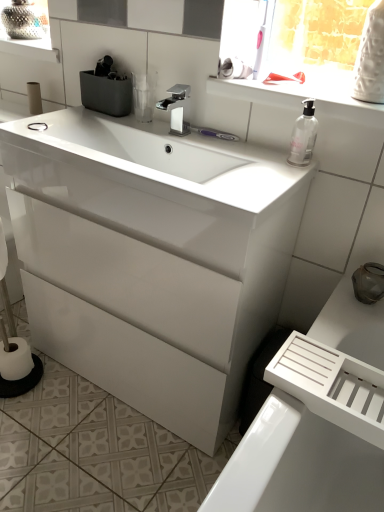
Question: Does white glossy cabinet at center have a lesser height compared to white matte toilet paper at left, which appears as the first toilet paper when viewed from the top?

Choices:
 (A) no
 (B) yes

Answer: (A)

Question: Is white matte toilet paper at left, which is counted as the 3th toilet paper, starting from the bottom, at the back of white glossy cabinet at center?

Choices:
 (A) yes
 (B) no

Answer: (B)

Question: From a real-world perspective, is white glossy cabinet at center positioned over white matte toilet paper at left, which appears as the first toilet paper when viewed from the top, based on gravity?

Choices:
 (A) yes
 (B) no

Answer: (B)

Question: Is white glossy cabinet at center surrounding white matte toilet paper at left, which is the 2th toilet paper from right to left?

Choices:
 (A) yes
 (B) no

Answer: (B)

Question: Is white glossy cabinet at center thinner than white matte toilet paper at left, which is counted as the 3th toilet paper, starting from the bottom?

Choices:
 (A) yes
 (B) no

Answer: (B)

Question: From a real-world perspective, relative to white glossy cabinet at center, is white glossy sink at center vertically above or below?

Choices:
 (A) above
 (B) below

Answer: (A)

Question: From the image's perspective, is white glossy sink at center positioned above or below white glossy cabinet at center?

Choices:
 (A) above
 (B) below

Answer: (A)

Question: Is white glossy sink at center to the left or to the right of white glossy cabinet at center in the image?

Choices:
 (A) left
 (B) right

Answer: (B)

Question: In terms of width, does white glossy sink at center look wider or thinner when compared to white glossy cabinet at center?

Choices:
 (A) wide
 (B) thin

Answer: (B)

Question: Considering the positions of white glossy cabinet at center and white matte toilet paper at left, which is counted as the 3th toilet paper, starting from the bottom, in the image, is white glossy cabinet at center taller or shorter than white matte toilet paper at left, which is counted as the 3th toilet paper, starting from the bottom,?

Choices:
 (A) tall
 (B) short

Answer: (A)

Question: From the image's perspective, is white glossy cabinet at center located above or below white matte toilet paper at left, positioned as the first toilet paper in back-to-front order?

Choices:
 (A) above
 (B) below

Answer: (B)

Question: From a real-world perspective, is white glossy cabinet at center physically located above or below white matte toilet paper at left, the 2th toilet paper positioned from the left?

Choices:
 (A) below
 (B) above

Answer: (A)

Question: Is white glossy cabinet at center in front of or behind white matte toilet paper at left, which is the 2th toilet paper from right to left, in the image?

Choices:
 (A) behind
 (B) front

Answer: (B)

Question: Is point (187, 86) closer or farther from the camera than point (34, 83)?

Choices:
 (A) closer
 (B) farther

Answer: (A)

Question: From the image's perspective, is polished chrome faucet at center located above or below white matte toilet paper at left, the 2th toilet paper positioned from the left?

Choices:
 (A) above
 (B) below

Answer: (B)